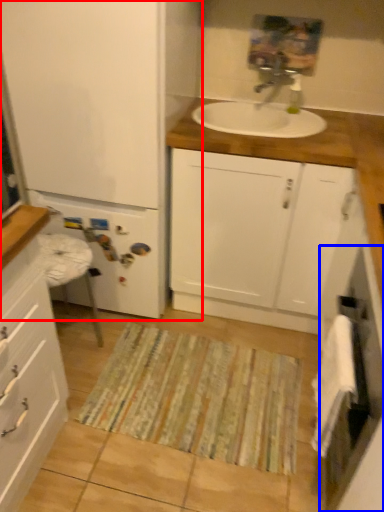
Question: Which of the following is the farthest to the observer, bathroom cabinet (highlighted by a red box) or screen door (highlighted by a blue box)?

Choices:
 (A) bathroom cabinet
 (B) screen door

Answer: (A)